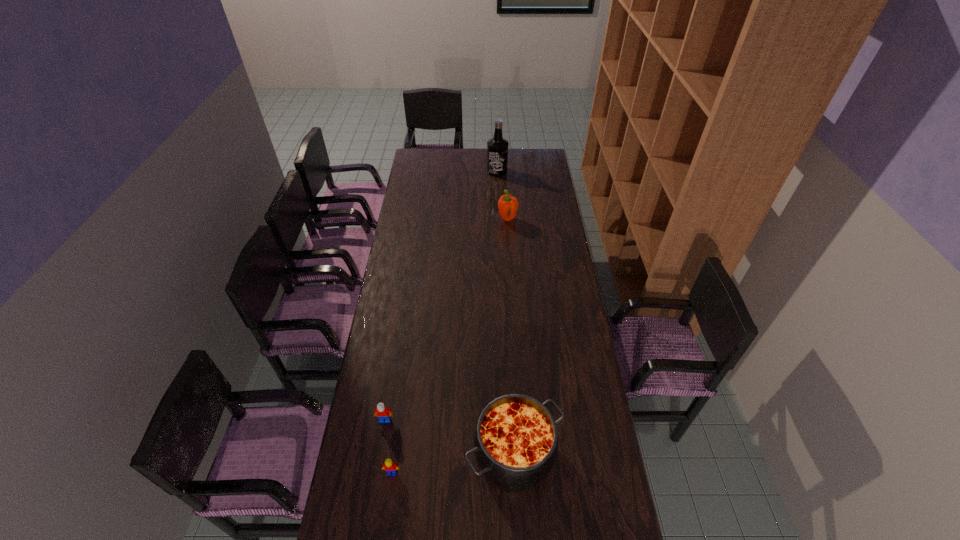
At what (x,y) coordinates should I click in order to perform the action: click on free space located on the back of the second farthest object. Please return your answer as a coordinate pair (x, y). Looking at the image, I should click on (505, 185).

What are the coordinates of `blank space located 0.320m on the face of the farther Lego` in the screenshot? It's located at (369, 524).

This screenshot has width=960, height=540. I want to click on vacant area situated 0.130m on the front-facing side of the shorter Lego, so click(386, 520).

Image resolution: width=960 pixels, height=540 pixels. Find the location of `object at the far edge`. object at the far edge is located at coordinates (497, 147).

I want to click on object that is at the right edge, so click(515, 443).

The image size is (960, 540). In the image, there is a desktop. Find the location of `free region at the far edge`. free region at the far edge is located at coordinates (471, 168).

The height and width of the screenshot is (540, 960). I want to click on vacant region at the left edge, so click(418, 245).

Image resolution: width=960 pixels, height=540 pixels. I want to click on vacant space at the right edge of the desktop, so click(581, 482).

This screenshot has height=540, width=960. Identify the location of vacant space at the far left corner of the desktop. (417, 160).

Find the location of a particular element. This screenshot has width=960, height=540. vacant area at the far right corner is located at coordinates (526, 165).